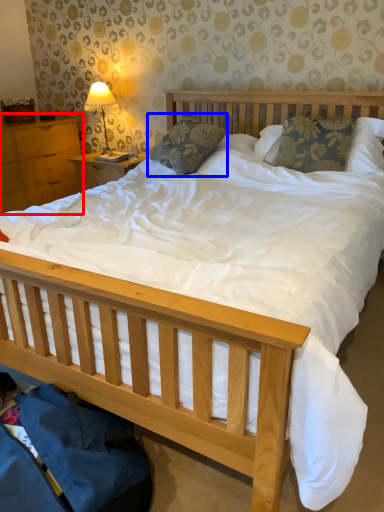
Question: Which object is closer to the camera taking this photo, nightstand (highlighted by a red box) or pillow (highlighted by a blue box)?

Choices:
 (A) nightstand
 (B) pillow

Answer: (B)